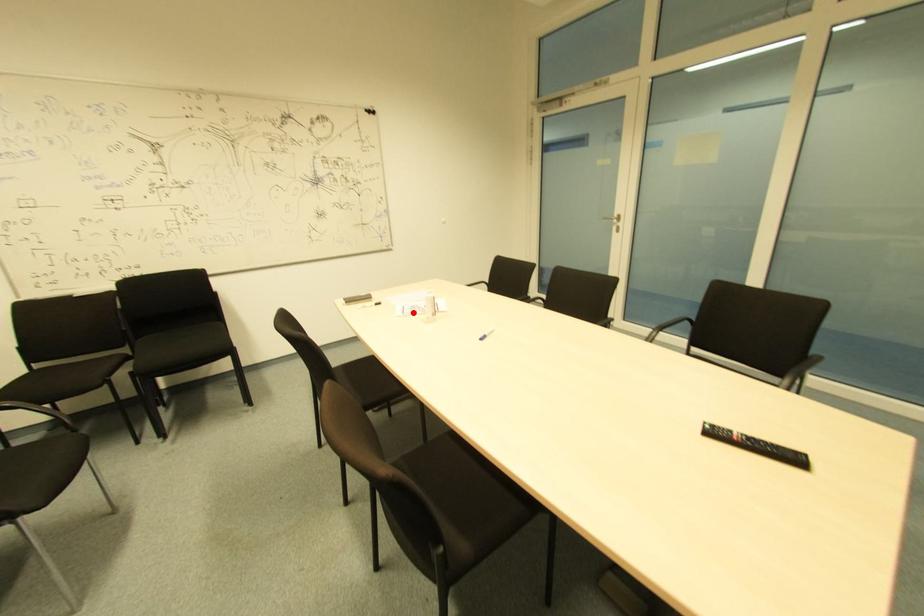
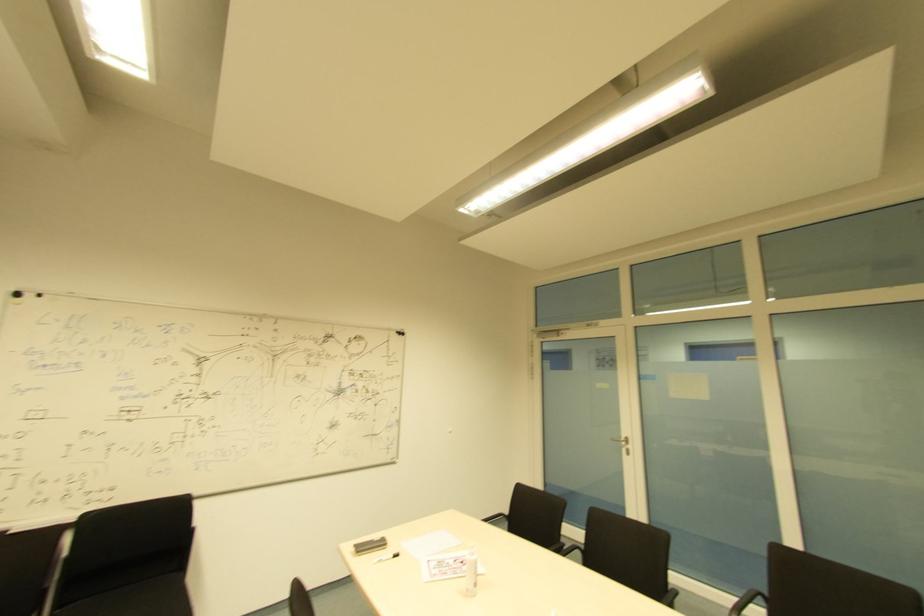
The point at the highlighted location is marked in the first image. Where is the corresponding point in the second image?

(444, 572)